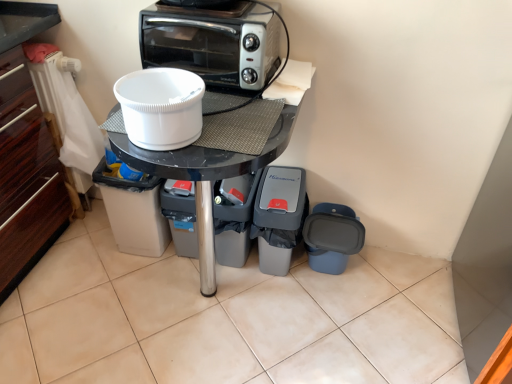
I want to click on free spot to the right of black glossy table at center, so click(x=349, y=316).